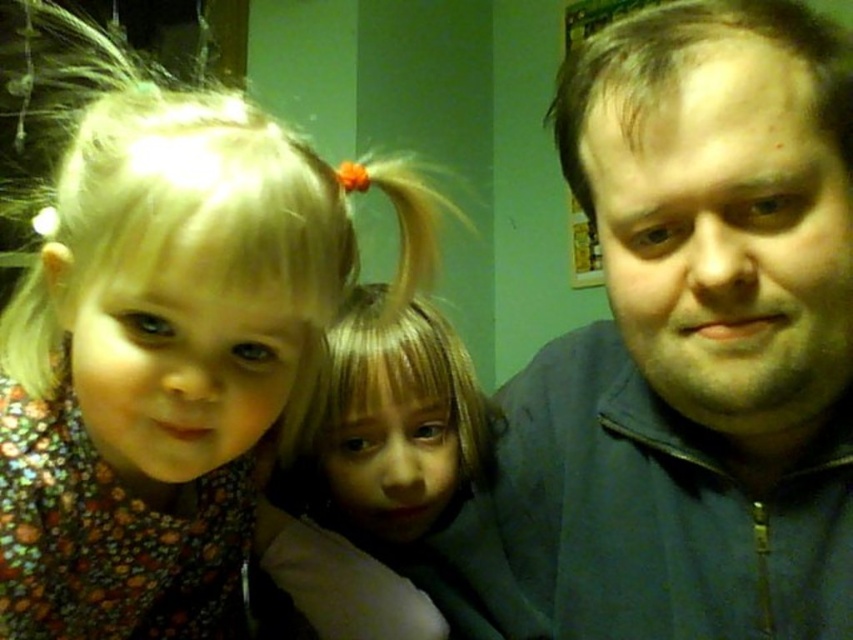
Question: From the image, what is the correct spatial relationship of blue zip-up jacket at center in relation to blonde hair at center?

Choices:
 (A) below
 (B) above

Answer: (B)

Question: Is the position of blue zip-up jacket at center less distant than that of blonde hair at left?

Choices:
 (A) no
 (B) yes

Answer: (B)

Question: Which point is closer to the camera?

Choices:
 (A) (180, 132)
 (B) (665, 202)
 (C) (482, 525)

Answer: (B)

Question: Which of the following is the closest to the observer?

Choices:
 (A) (503, 387)
 (B) (397, 387)

Answer: (B)

Question: Which object is positioned farthest from the blonde hair at left?

Choices:
 (A) blonde hair at center
 (B) blue zip-up jacket at center

Answer: (B)

Question: Is blue zip-up jacket at center thinner than blonde hair at center?

Choices:
 (A) yes
 (B) no

Answer: (A)